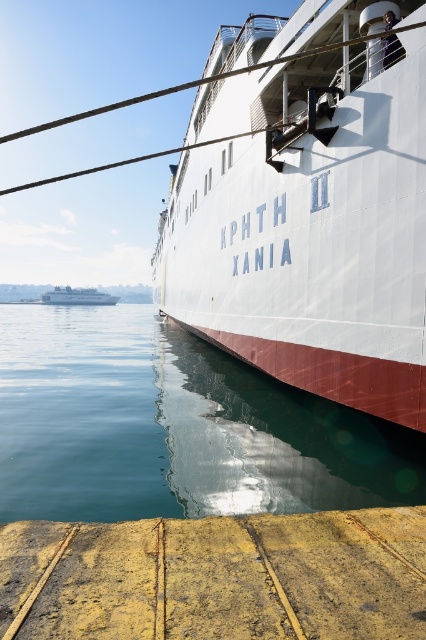
Can you confirm if transparent water at lower left is taller than white glossy cruise ship at lower left?

In fact, transparent water at lower left may be shorter than white glossy cruise ship at lower left.

Can you confirm if transparent water at lower left is positioned above white glossy cruise ship at lower left?

Actually, transparent water at lower left is below white glossy cruise ship at lower left.

At what (x,y) coordinates should I click in order to perform the action: click on transparent water at lower left. Please return your answer as a coordinate pair (x, y). This screenshot has width=426, height=640. Looking at the image, I should click on (175, 428).

What are the coordinates of `yellow weathered wood at lower center` in the screenshot? It's located at (218, 577).

Measure the distance between yellow weathered wood at lower center and white glossy cruise ship at lower left.

yellow weathered wood at lower center and white glossy cruise ship at lower left are 228.25 meters apart from each other.

Identify the location of yellow weathered wood at lower center. (218, 577).

I want to click on yellow weathered wood at lower center, so click(x=218, y=577).

Can you confirm if transparent water at lower left is wider than yellow weathered wood at lower center?

Indeed, transparent water at lower left has a greater width compared to yellow weathered wood at lower center.

Between point (31, 378) and point (307, 525), which one is positioned behind?

Positioned behind is point (31, 378).

What are the coordinates of `transparent water at lower left` in the screenshot? It's located at (175, 428).